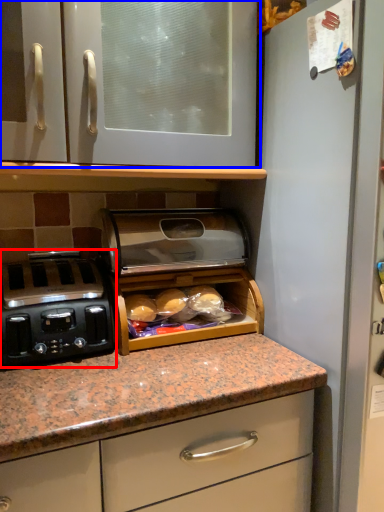
Question: Which of the following is the closest to the observer, home appliance (highlighted by a red box) or cabinetry (highlighted by a blue box)?

Choices:
 (A) home appliance
 (B) cabinetry

Answer: (B)